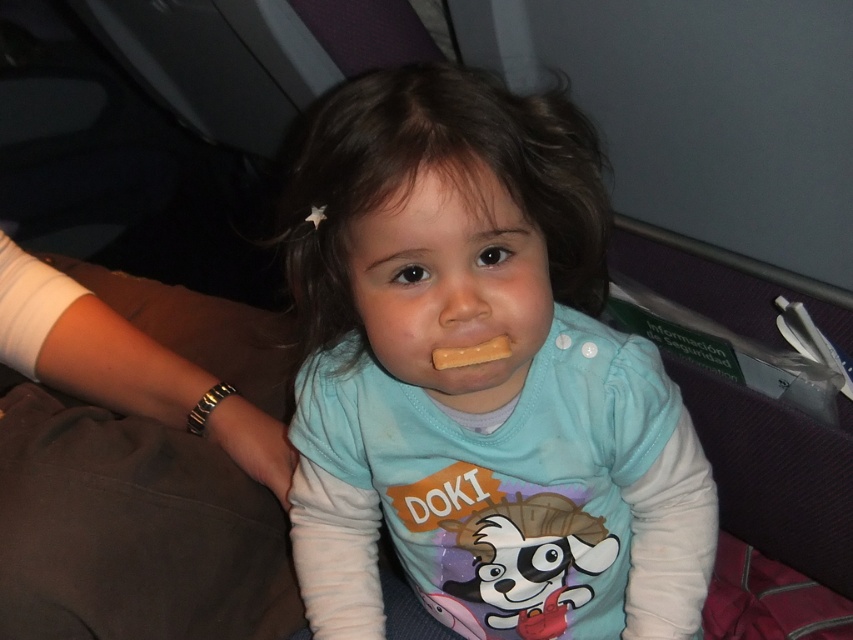
Question: Which object appears closest to the camera in this image?

Choices:
 (A) yellow matte stick at mouth
 (B) matte blue shirt at center

Answer: (B)

Question: Does matte blue shirt at center have a larger size compared to yellow matte stick at mouth?

Choices:
 (A) no
 (B) yes

Answer: (B)

Question: Which of the following is the farthest from the observer?

Choices:
 (A) (465, 362)
 (B) (560, 141)

Answer: (B)

Question: Which point is farther to the camera?

Choices:
 (A) (476, 353)
 (B) (601, 340)

Answer: (B)

Question: Can you confirm if matte blue shirt at center is positioned to the left of yellow matte stick at mouth?

Choices:
 (A) yes
 (B) no

Answer: (B)

Question: Is matte blue shirt at center above yellow matte stick at mouth?

Choices:
 (A) yes
 (B) no

Answer: (B)